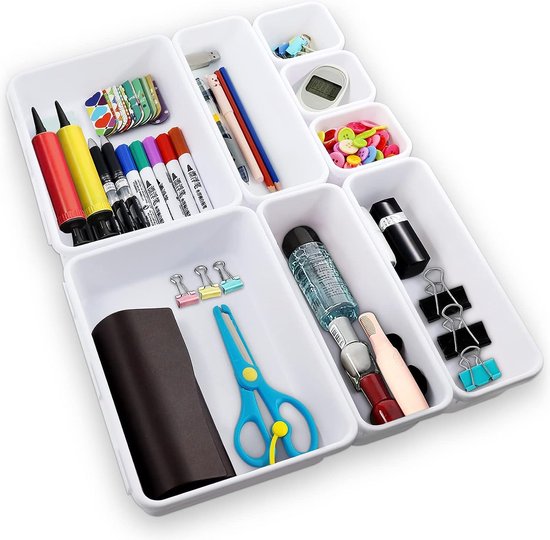
In order to click on binder clips in this screenshot , I will do `click(478, 371)`, `click(466, 338)`, `click(455, 293)`, `click(230, 284)`, `click(210, 290)`, `click(186, 298)`, `click(297, 43)`, `click(280, 46)`.